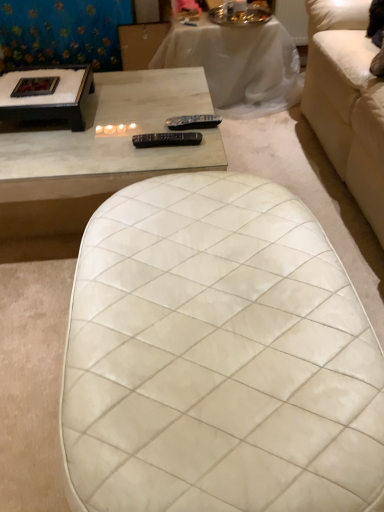
Where is `vacant location behind black plastic remote at center, the 2th remote in the back-to-front sequence`? vacant location behind black plastic remote at center, the 2th remote in the back-to-front sequence is located at coordinates click(x=163, y=122).